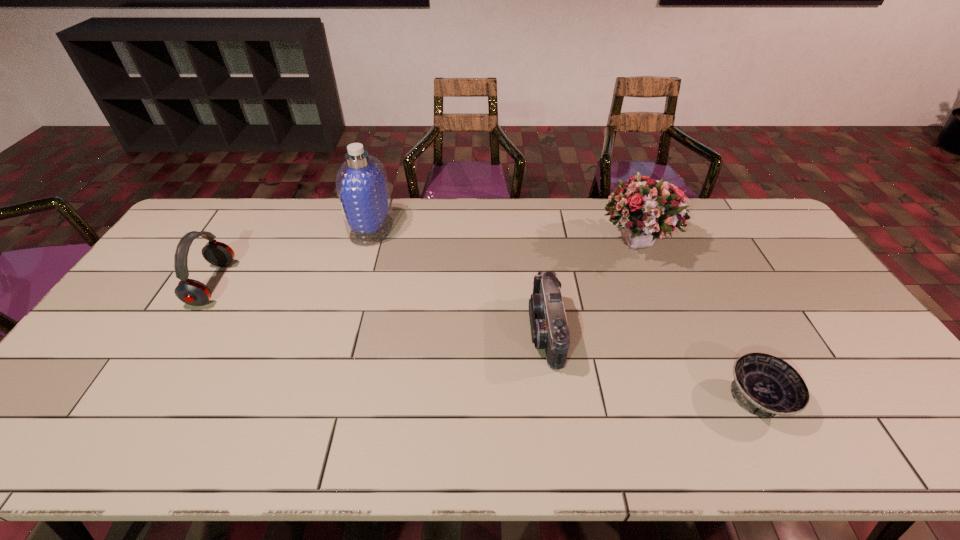
At what (x,y) coordinates should I click in order to perform the action: click on the tallest object. Please return your answer as a coordinate pair (x, y). Looking at the image, I should click on pos(362,187).

This screenshot has width=960, height=540. What are the coordinates of `cleansing agent` in the screenshot? It's located at (362, 187).

The image size is (960, 540). Identify the location of the second tallest object. (646, 209).

You are a GUI agent. You are given a task and a screenshot of the screen. Output one action in this format:
    pyautogui.click(x=<x>, y=<y>)
    Task: Click on the earphone
    This screenshot has height=540, width=960.
    Given the screenshot: What is the action you would take?
    pyautogui.click(x=192, y=292)

Identify the location of the leftmost object. (192, 292).

At what (x,y) coordinates should I click in order to perform the action: click on the second shortest object. Please return your answer as a coordinate pair (x, y). Looking at the image, I should click on (549, 328).

In order to click on camcorder in this screenshot , I will do `click(549, 328)`.

In order to click on bowl in this screenshot , I will do tap(764, 385).

Locate an element on the screen. The height and width of the screenshot is (540, 960). free region located on the front of the tallest object is located at coordinates (348, 310).

You are a GUI agent. You are given a task and a screenshot of the screen. Output one action in this format:
    pyautogui.click(x=<x>, y=<y>)
    Task: Click on the vacant region located on the left of the fourth shortest object
    
    Given the screenshot: What is the action you would take?
    pyautogui.click(x=564, y=244)